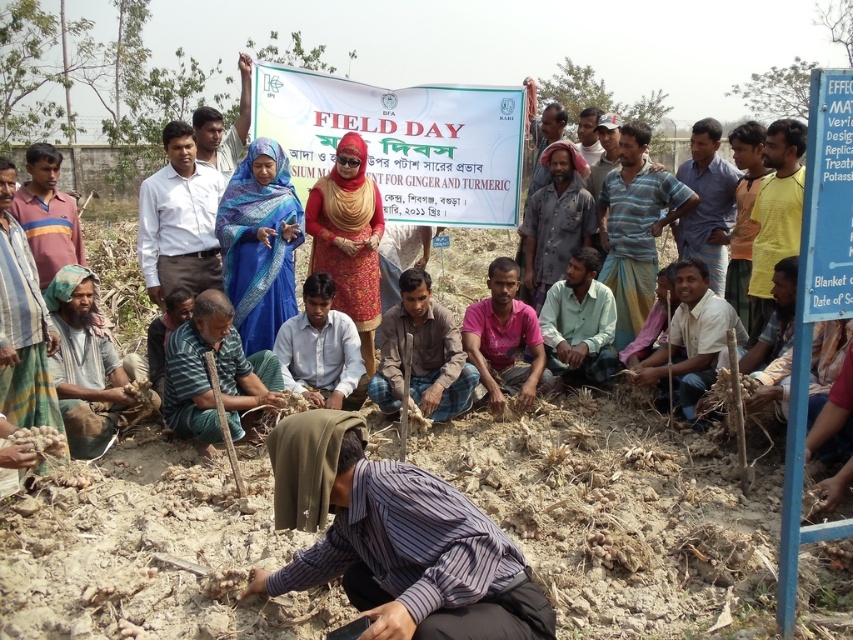
You are a photographer trying to capture a photo of the white fabric banner at center and the gray fabric cloth at lower left. Which object should you focus on first if you want to include both in your frame without moving the camera?

The white fabric banner at center is located above the gray fabric cloth at lower left, so you should focus on the white fabric banner at center first to ensure both are in the frame without moving the camera.

In the scene shown: You are a photographer positioned at the origin point of the image. You want to capture a photo that includes both the point at (331, 182) and the point at (660, 365). Which point should you focus on first to ensure both are in frame?

You should focus on point (660, 365) first because point (331, 182) is behind it, so adjusting the camera to include the closer point will naturally include the one behind as well.